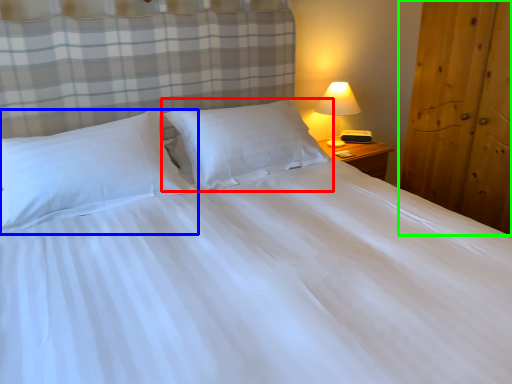
Question: Considering the real-world distances, which object is closest to pillow (highlighted by a red box)? pillow (highlighted by a blue box) or armoire (highlighted by a green box).

Choices:
 (A) pillow
 (B) armoire

Answer: (A)